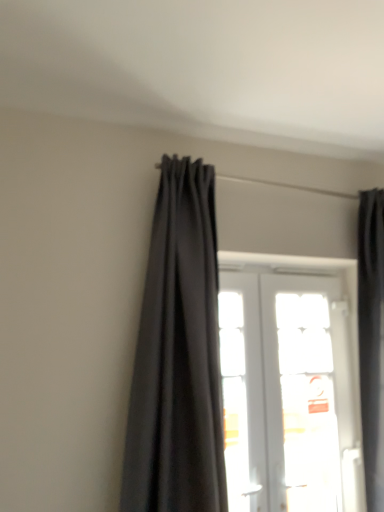
Question: Is white glossy door at center taller than dark gray fabric curtain at center?

Choices:
 (A) yes
 (B) no

Answer: (B)

Question: From the image's perspective, would you say white glossy door at center is positioned over dark gray fabric curtain at center?

Choices:
 (A) no
 (B) yes

Answer: (A)

Question: Is the position of white glossy door at center less distant than that of dark gray fabric curtain at center?

Choices:
 (A) yes
 (B) no

Answer: (B)

Question: Does white glossy door at center have a lesser height compared to dark gray fabric curtain at center?

Choices:
 (A) yes
 (B) no

Answer: (A)

Question: From the image's perspective, is white glossy door at center under dark gray fabric curtain at center?

Choices:
 (A) yes
 (B) no

Answer: (A)

Question: Is white glossy door at center surrounding dark gray fabric curtain at center?

Choices:
 (A) no
 (B) yes

Answer: (A)

Question: Is dark gray fabric curtain at center wider than white glossy door at center?

Choices:
 (A) no
 (B) yes

Answer: (B)

Question: Can you confirm if dark gray fabric curtain at center is positioned to the left of white glossy door at center?

Choices:
 (A) no
 (B) yes

Answer: (B)

Question: From the image's perspective, is dark gray fabric curtain at center on white glossy door at center?

Choices:
 (A) yes
 (B) no

Answer: (A)

Question: Is dark gray fabric curtain at center positioned before white glossy door at center?

Choices:
 (A) yes
 (B) no

Answer: (A)

Question: Would you say dark gray fabric curtain at center contains white glossy door at center?

Choices:
 (A) yes
 (B) no

Answer: (B)

Question: Is dark gray fabric curtain at center further to the viewer compared to white glossy door at center?

Choices:
 (A) yes
 (B) no

Answer: (B)

Question: In the image, is white glossy door at center positioned in front of or behind dark gray fabric curtain at center?

Choices:
 (A) front
 (B) behind

Answer: (B)